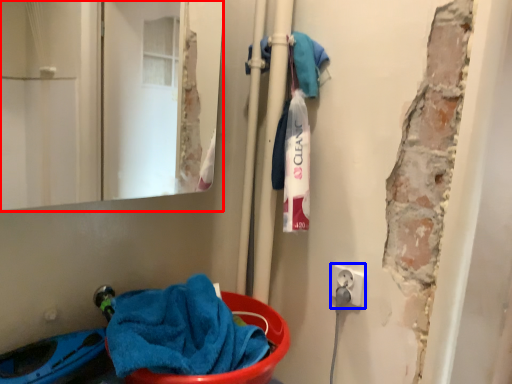
Question: Which object is closer to the camera taking this photo, mirror (highlighted by a red box) or electric outlet (highlighted by a blue box)?

Choices:
 (A) mirror
 (B) electric outlet

Answer: (A)